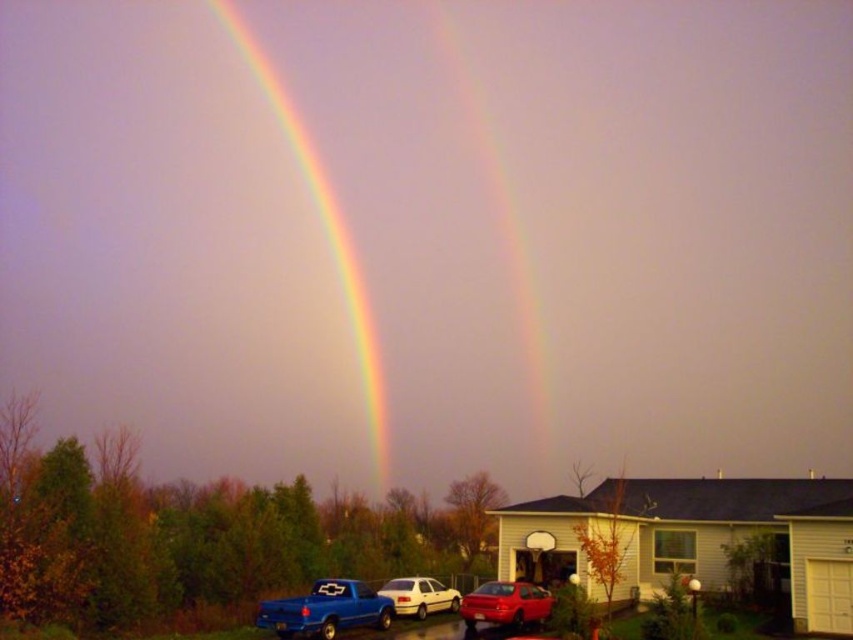
You are a pedestrian standing on the sidewalk in front of the house. You see the matte blue truck at lower left and the white matte sedan at center. Which vehicle is closer to the left side of the road?

The matte blue truck at lower left is closer to the left side of the road because it is positioned to the left of the white matte sedan at center.

You are a photographer trying to capture both the metallic blue truck at lower left and the rainbow at upper left in a single frame. Given their sizes, which object might require you to adjust your camera angle to ensure both are fully visible?

The metallic blue truck at lower left occupies less space than the rainbow at upper left. Since the rainbow at upper left is larger, you might need to adjust your camera angle to ensure it fits entirely within the frame while also capturing the smaller metallic blue truck at lower left.

You are a photographer trying to capture both the rainbow at upper left and the shiny red sedan at center in a single frame. Based on their sizes, which object would appear larger in the photo?

The rainbow at upper left would appear larger in the photo because its width surpasses that of the shiny red sedan at center.